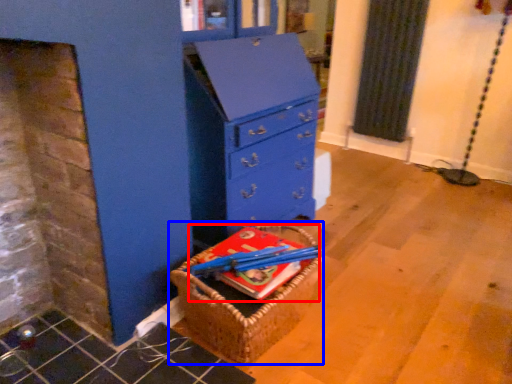
Question: Among these objects, which one is nearest to the camera, book (highlighted by a red box) or basket (highlighted by a blue box)?

Choices:
 (A) book
 (B) basket

Answer: (B)